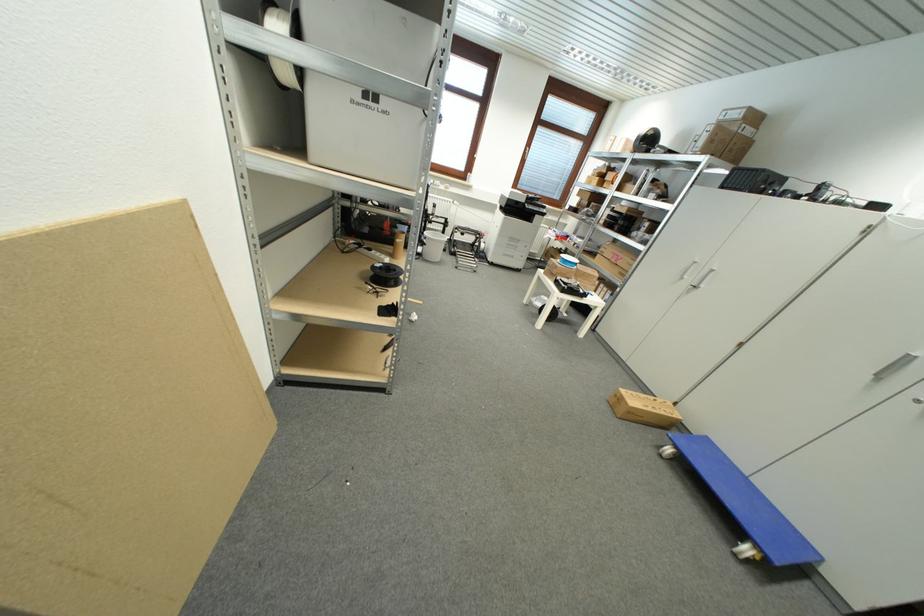
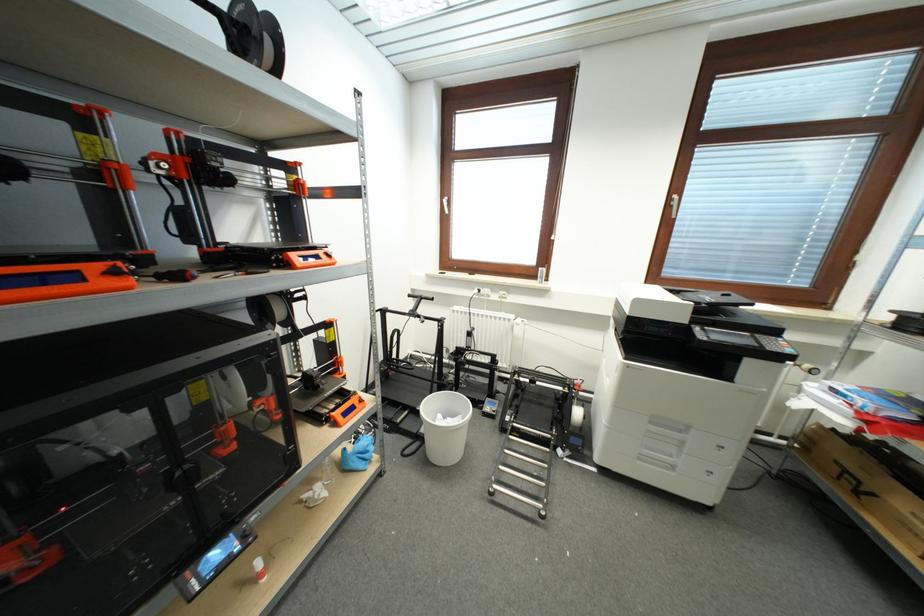
Locate, in the second image, the point that corresponds to the point at 467,237 in the first image.

(537, 384)